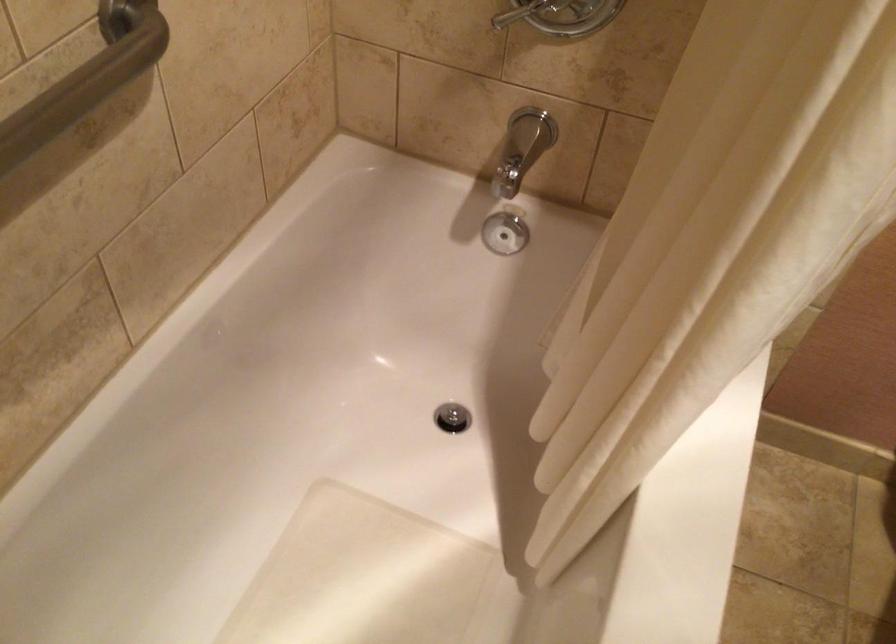
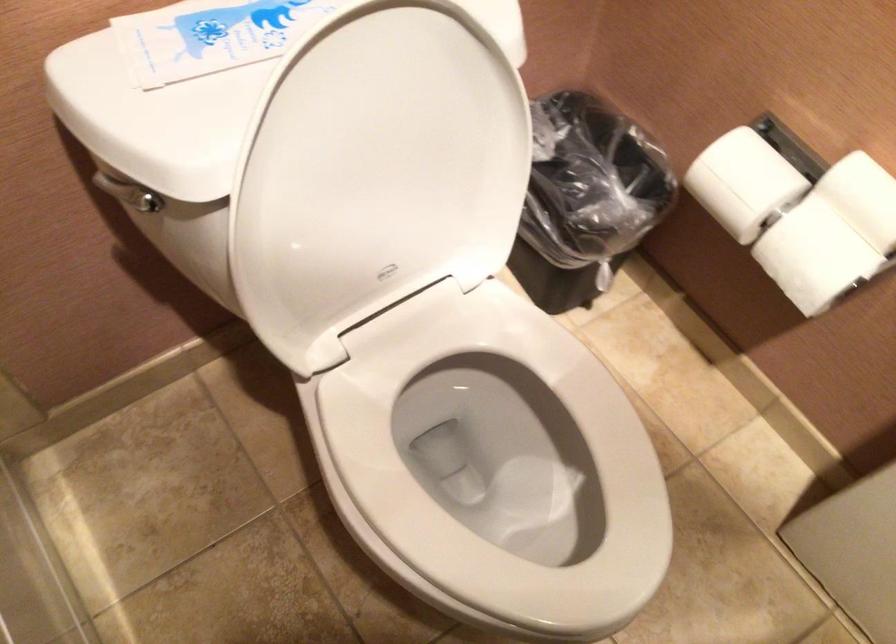
In the scene shown: How did the camera likely rotate?

The camera's rotation is toward right-down.